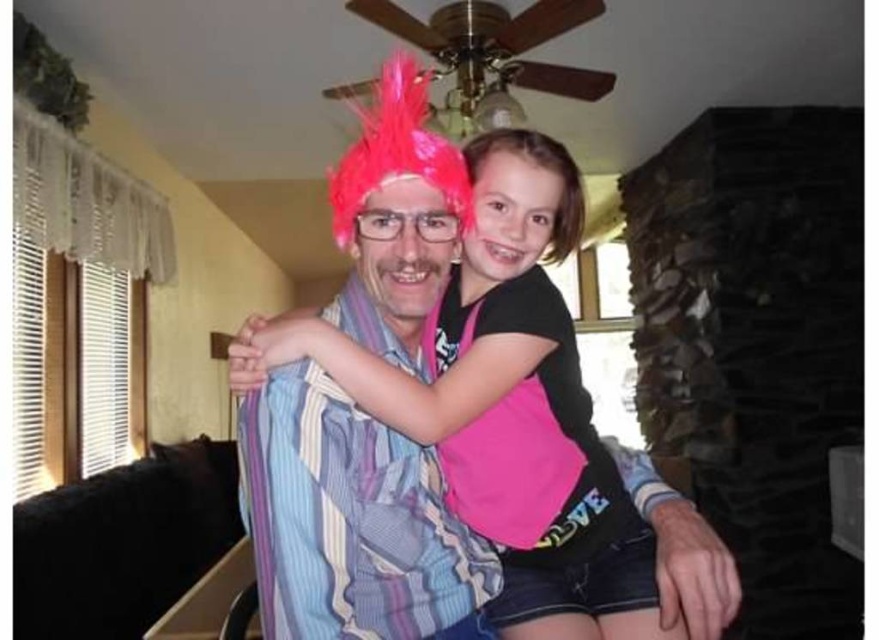
You are a photographer setting up a photo shoot in this room. You need to place a 1.2 meter tall prop between the pink fabric at center and the pink feathered wig at upper center. Based on their heights, which object should the prop be placed closer to?

The pink fabric at center is much taller than the pink feathered wig at upper center, so the prop should be placed closer to the pink feathered wig at upper center to maintain balance in height.

You are taking a photo of two people in a cozy home. There are two points marked in the image. The first point is at coordinates point (381, 365) and the second point is at point (522, 132). Which point is closer to the camera?

Point (381, 365) is closer to the camera than point (522, 132).

You are a tailor measuring materials for a costume. You have a piece of pink fabric at center and a pink feathered wig at upper center. Which material has a greater width?

A: The pink fabric at center has a greater width than the pink feathered wig at upper center because the pink fabric at center is wider.